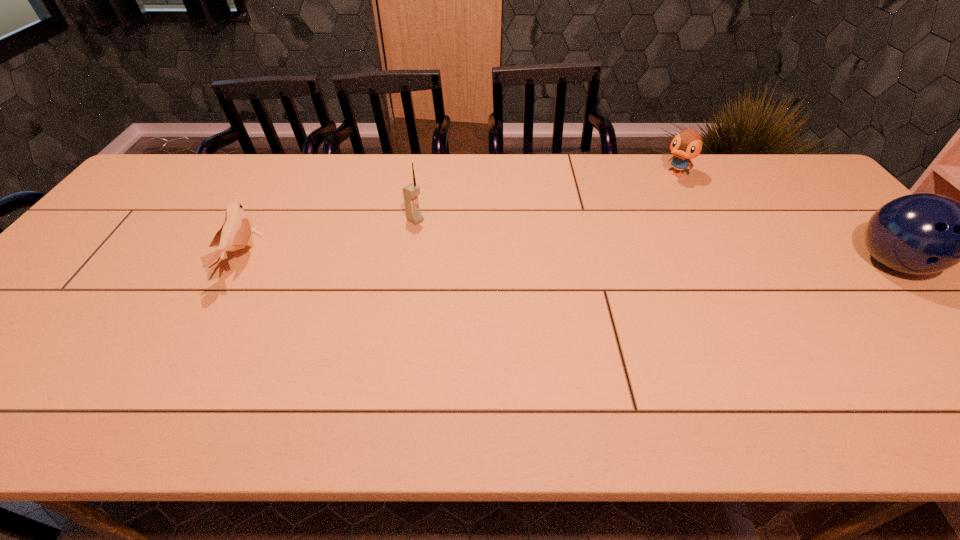
Image resolution: width=960 pixels, height=540 pixels. Find the location of `free space between the second object from right to left and the shortest object`. free space between the second object from right to left and the shortest object is located at coordinates (458, 217).

This screenshot has height=540, width=960. Identify the location of object that stands as the closest to the farthest object. (924, 233).

Locate an element on the screen. The image size is (960, 540). object identified as the closest to the bird is located at coordinates (410, 193).